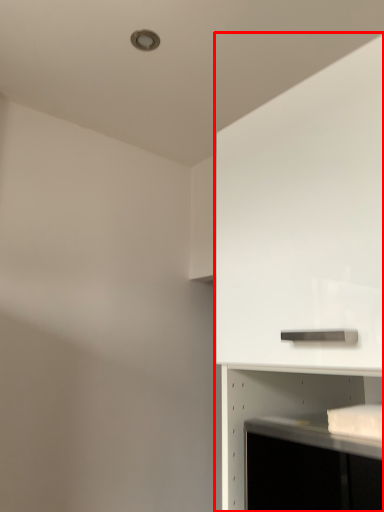
Question: From the image's perspective, where is cabinetry (annotated by the red box) located in relation to shelf in the image?

Choices:
 (A) below
 (B) above

Answer: (B)